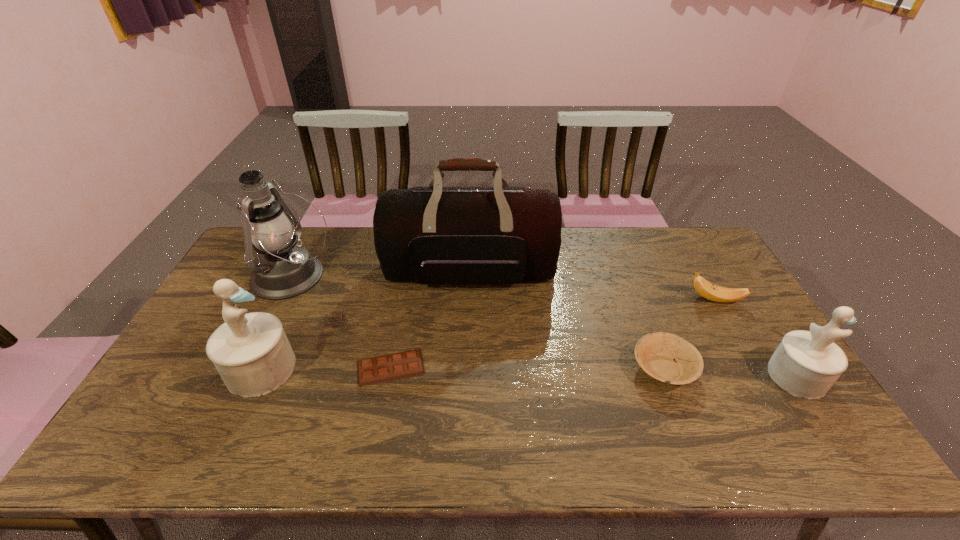
To make them evenly spaced by inserting another figurine among them, please locate a free space for this new figurine. Please provide its 2D coordinates. Your answer should be formatted as a tuple, i.e. [(x, y)], where the tuple contains the x and y coordinates of a point satisfying the conditions above.

[(527, 373)]